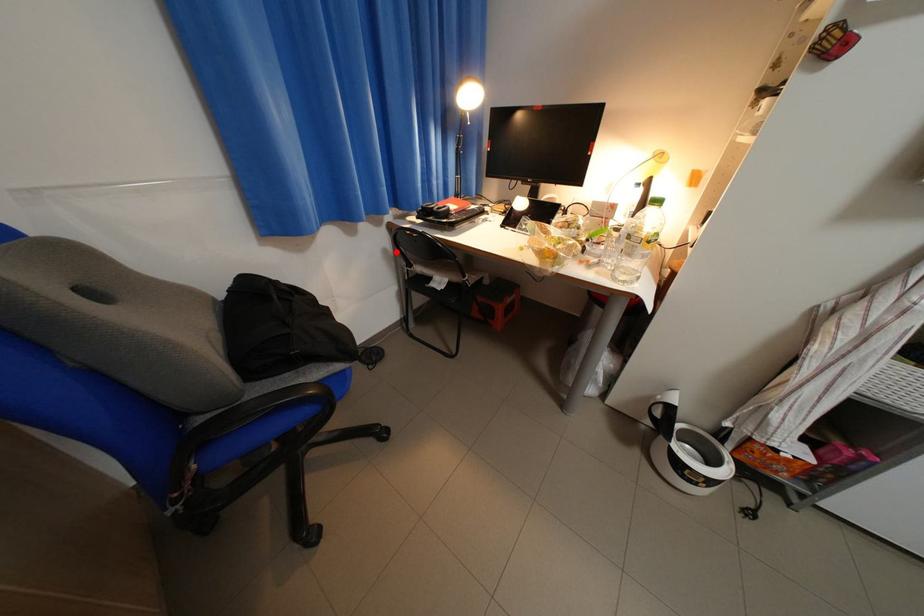
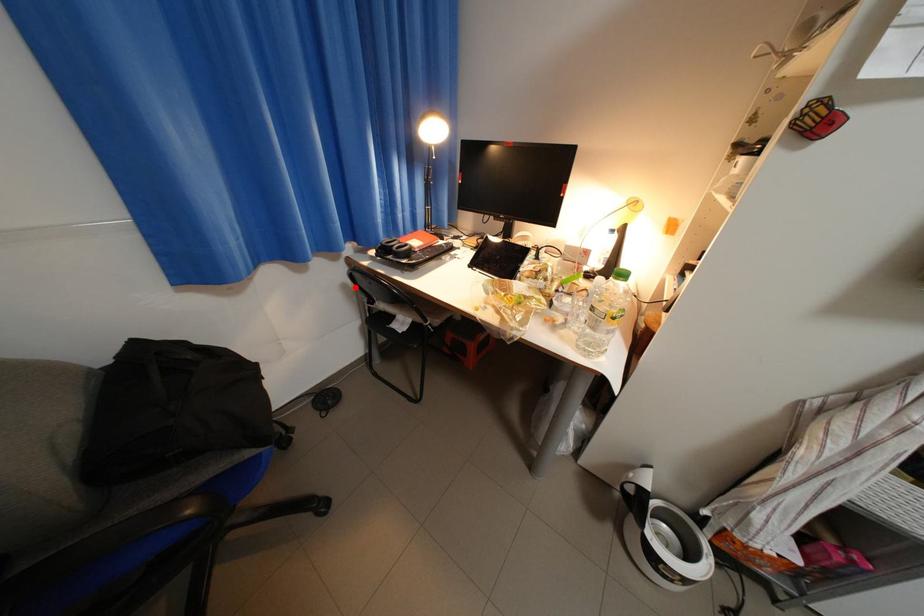
I am providing you with two images of the same scene from different viewpoints. A red point is marked on the first image and another point is marked on the second image. Do the highlighted points in image1 and image2 indicate the same real-world spot?

Yes